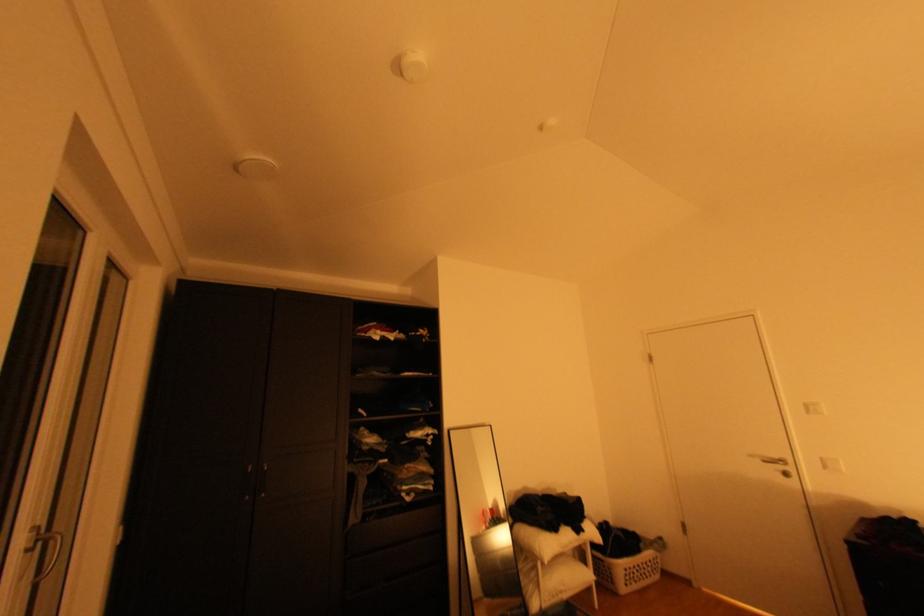
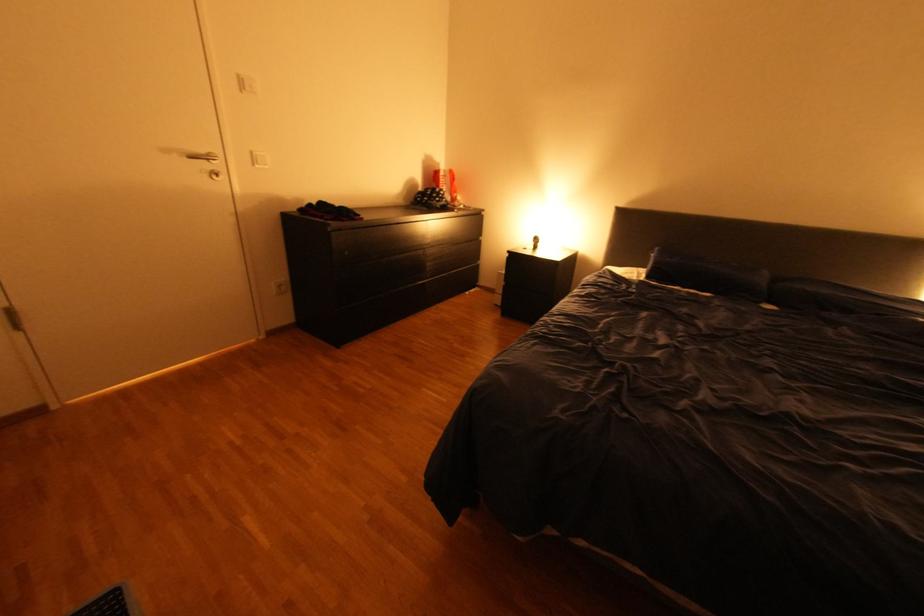
Find the pixel in the second image that matches point (835, 467) in the first image.

(264, 161)